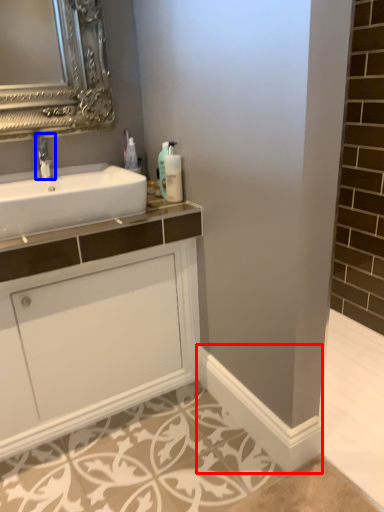
Question: Which object appears closest to the camera in this image, molding (highlighted by a red box) or tap (highlighted by a blue box)?

Choices:
 (A) molding
 (B) tap

Answer: (A)